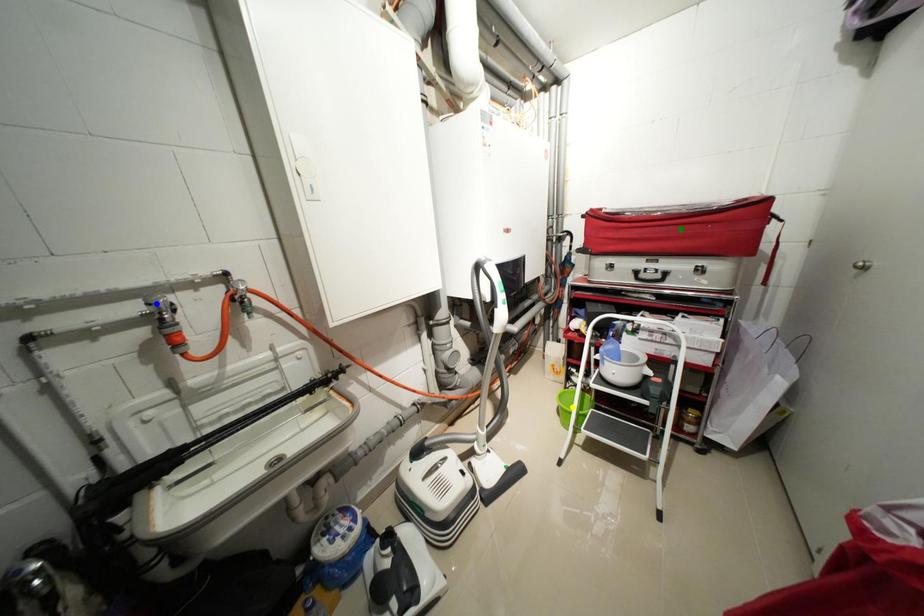
Order these from farthest to nearest:
- blue point
- yellow point
- green point

yellow point → green point → blue point